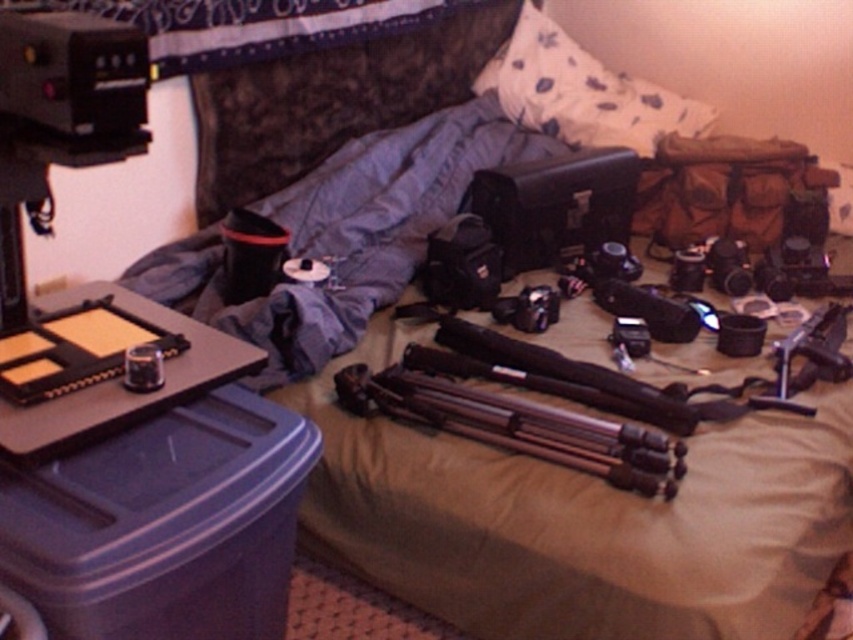
You are setting up a camera in the bedroom scene. The silver metallic tripod at center is located at coordinates 0.667 on the x axis and 0.607 on the y axis. If you want to place a new camera exactly 0.1 units to the right of the tripod, what would be the new x coordinate?

The new x coordinate would be 0.667 plus 0.1, which equals 0.767.

You are setting up a photography shoot in this bedroom. You need to place a new camera bag between the silver metallic tripod at center and the white floral fabric pillow at upper center. Which side of the tripod should you place it on to ensure it fits without overlapping the pillow?

The silver metallic tripod at center is thinner than the white floral fabric pillow at upper center, so placing the camera bag on the side of the tripod closer to the pillow would ensure it fits without overlapping since the tripod is narrower there.